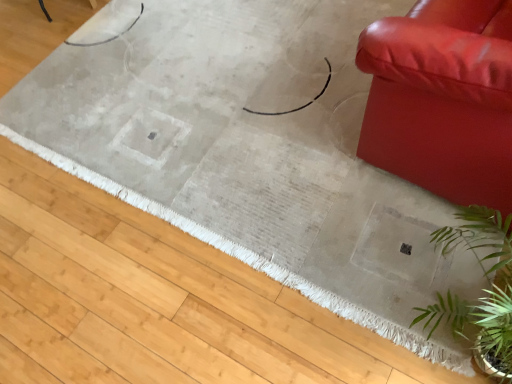
Question: Does beige woven rug at center come behind shiny leather couch at right?

Choices:
 (A) no
 (B) yes

Answer: (B)

Question: Considering the relative sizes of beige woven rug at center and shiny leather couch at right in the image provided, is beige woven rug at center taller than shiny leather couch at right?

Choices:
 (A) yes
 (B) no

Answer: (B)

Question: Considering the relative sizes of beige woven rug at center and shiny leather couch at right in the image provided, is beige woven rug at center wider than shiny leather couch at right?

Choices:
 (A) no
 (B) yes

Answer: (B)

Question: Can you confirm if beige woven rug at center is positioned to the right of shiny leather couch at right?

Choices:
 (A) no
 (B) yes

Answer: (A)

Question: Does beige woven rug at center have a smaller size compared to shiny leather couch at right?

Choices:
 (A) no
 (B) yes

Answer: (A)

Question: In terms of height, does green leafy plant at lower right look taller or shorter compared to shiny leather couch at right?

Choices:
 (A) short
 (B) tall

Answer: (A)

Question: Considering the positions of green leafy plant at lower right and shiny leather couch at right in the image, is green leafy plant at lower right bigger or smaller than shiny leather couch at right?

Choices:
 (A) small
 (B) big

Answer: (A)

Question: From the image's perspective, relative to shiny leather couch at right, is green leafy plant at lower right above or below?

Choices:
 (A) above
 (B) below

Answer: (B)

Question: Is green leafy plant at lower right inside the boundaries of shiny leather couch at right, or outside?

Choices:
 (A) outside
 (B) inside

Answer: (A)

Question: Is shiny leather couch at right bigger or smaller than green leafy plant at lower right?

Choices:
 (A) big
 (B) small

Answer: (A)

Question: In terms of width, does shiny leather couch at right look wider or thinner when compared to green leafy plant at lower right?

Choices:
 (A) thin
 (B) wide

Answer: (B)

Question: From the image's perspective, relative to green leafy plant at lower right, is shiny leather couch at right above or below?

Choices:
 (A) above
 (B) below

Answer: (A)

Question: Is shiny leather couch at right to the left or to the right of green leafy plant at lower right in the image?

Choices:
 (A) right
 (B) left

Answer: (A)

Question: From a real-world perspective, is beige woven rug at center positioned above or below green leafy plant at lower right?

Choices:
 (A) above
 (B) below

Answer: (B)

Question: Considering the positions of point (29, 307) and point (463, 311), is point (29, 307) closer or farther from the camera than point (463, 311)?

Choices:
 (A) closer
 (B) farther

Answer: (B)